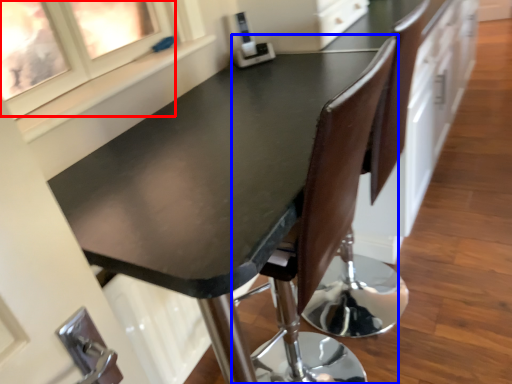
Question: Which object appears closest to the camera in this image, window (highlighted by a red box) or chair (highlighted by a blue box)?

Choices:
 (A) window
 (B) chair

Answer: (A)